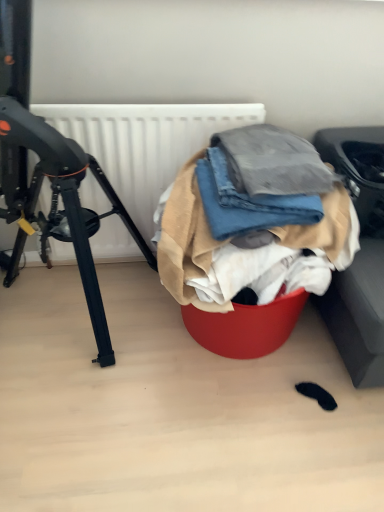
Where is `vacant space underneath black matte tripod at left (from a real-world perspective)`? The image size is (384, 512). vacant space underneath black matte tripod at left (from a real-world perspective) is located at coordinates (82, 318).